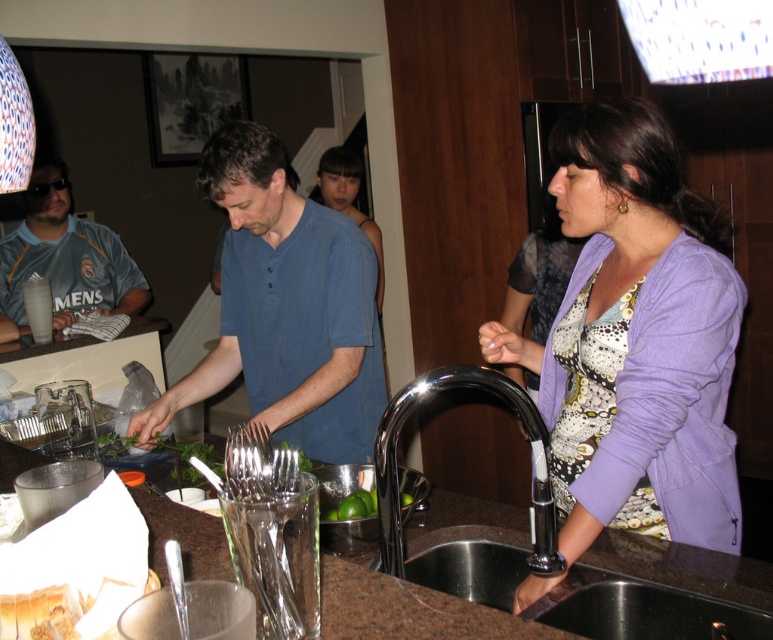
Is matte blue shirt at center shorter than chrome metallic faucet at sink right?

In fact, matte blue shirt at center may be taller than chrome metallic faucet at sink right.

Does point (53, 205) come closer to viewer compared to point (540, 518)?

No, (53, 205) is further to viewer.

Image resolution: width=773 pixels, height=640 pixels. I want to click on matte blue shirt at center, so click(x=63, y=259).

In the scene shown: Who is more forward, (x=635, y=118) or (x=336, y=516)?

Point (x=635, y=118) is in front.

Which of these two, purple cotton sweater at lower right or green matte limes at center, stands taller?

purple cotton sweater at lower right is taller.

Which is in front, point (584, 200) or point (363, 509)?

Positioned in front is point (363, 509).

What are the coordinates of `purple cotton sweater at lower right` in the screenshot? It's located at (635, 339).

Can you confirm if brown granite countertop at center is bigger than metallic sink at lower center?

No, brown granite countertop at center is not bigger than metallic sink at lower center.

From the picture: Does brown granite countertop at center have a lesser width compared to metallic sink at lower center?

No, brown granite countertop at center is not thinner than metallic sink at lower center.

Between point (765, 573) and point (373, 563), which one is positioned in front?

Point (765, 573) is more forward.

Identify the location of brown granite countertop at center. (402, 608).